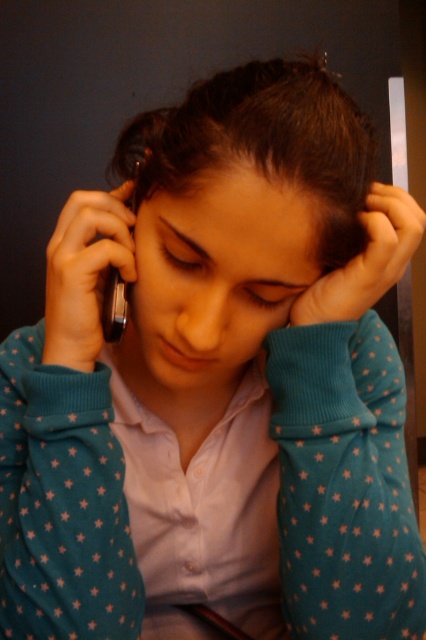
You are a photographer setting up a shot of the person in the scene. You need to ensure both the black matte phone at left and the black glossy smartphone at left are visible in the frame. Which phone should you position closer to the left edge of the frame to include both?

The black matte phone at left is to the left of the black glossy smartphone at left, so to include both in the frame, position the black matte phone at left closer to the left edge.

You are a photographer adjusting your camera settings to focus on two points in the image. The first point is at coordinates point (141, 157) and the second is at point (89, 269). Which point should you focus on first if you want to ensure the closest object is in sharp focus?

Point (141, 157) is further to the camera than point (89, 269), so you should focus on point (141, 157) first to ensure the closest object is in sharp focus.

You are a delivery person who needs to place two devices on a table. The table has a space that can only accommodate the smaller device. Which device should you choose between the matte black phone at center and the black glossy smartphone at left?

The black glossy smartphone at left is smaller than the matte black phone at center, so you should choose the black glossy smartphone at left to place on the table.